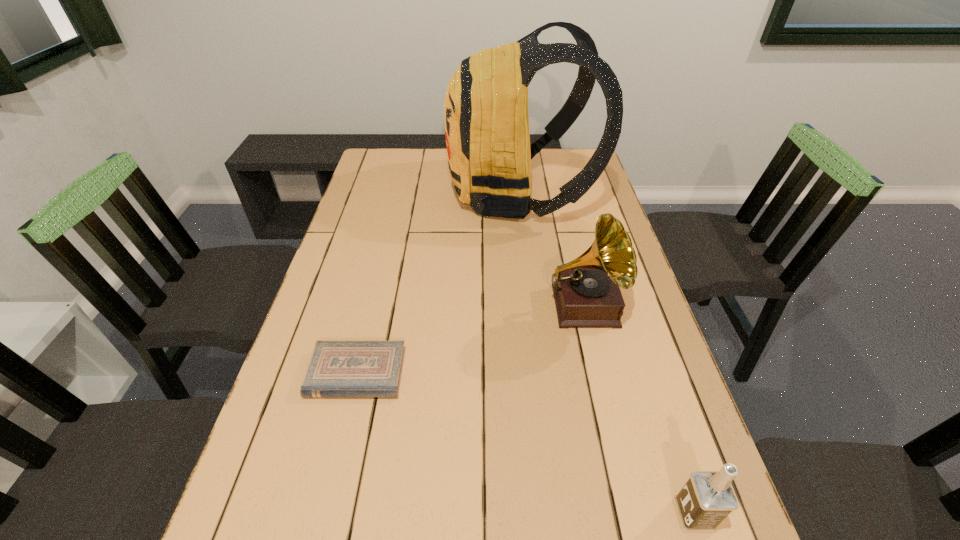
This screenshot has height=540, width=960. Find the location of `backpack`. backpack is located at coordinates (486, 118).

Locate an element on the screen. the farthest object is located at coordinates (486, 118).

Where is `the third nearest object`? the third nearest object is located at coordinates (586, 290).

This screenshot has width=960, height=540. In order to click on the second tallest object in this screenshot , I will do `click(586, 290)`.

The width and height of the screenshot is (960, 540). Identify the location of the nearest object. (707, 498).

This screenshot has height=540, width=960. I want to click on the third tallest object, so click(707, 498).

What are the coordinates of `the leftmost object` in the screenshot? It's located at (336, 368).

Identify the location of Bible. (336, 368).

Image resolution: width=960 pixels, height=540 pixels. Identify the location of vacant space located 0.160m on the front-facing side of the backpack. (402, 194).

In order to click on vacant space located on the front-facing side of the backpack in this screenshot , I will do point(359,194).